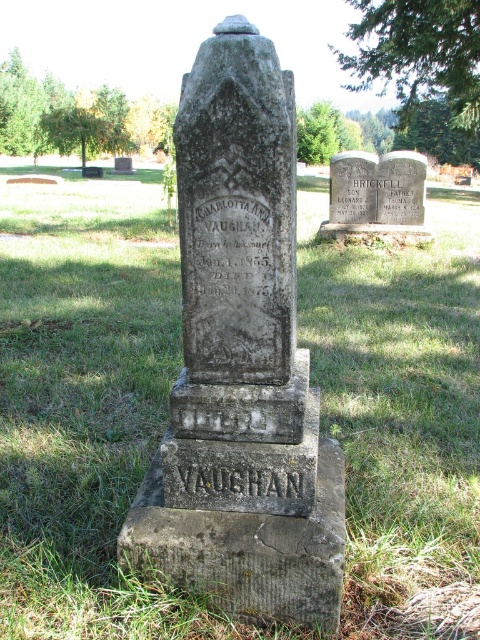
Question: Can you confirm if gray stone gravestone at center is positioned to the left of smooth gray stone at center?

Choices:
 (A) no
 (B) yes

Answer: (B)

Question: Based on their relative distances, which object is farther from the gray stone gravestone at center?

Choices:
 (A) smooth gray stone at center
 (B) green grass at center

Answer: (A)

Question: Estimate the real-world distances between objects in this image. Which object is farther from the gray stone gravestone at center?

Choices:
 (A) green grass at center
 (B) smooth gray stone at center

Answer: (B)

Question: Can you confirm if green grass at center is smaller than gray stone gravestone at center?

Choices:
 (A) yes
 (B) no

Answer: (B)

Question: Which point is farther from the camera taking this photo?

Choices:
 (A) (465, 419)
 (B) (250, 76)
 (C) (414, 186)

Answer: (C)

Question: Can you confirm if green grass at center is smaller than gray stone gravestone at center?

Choices:
 (A) yes
 (B) no

Answer: (B)